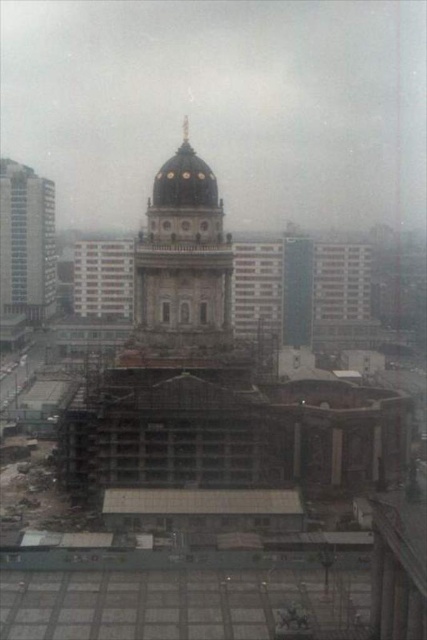
Question: From the image, what is the correct spatial relationship of dark gray stone dome at center in relation to white glass windows at left?

Choices:
 (A) right
 (B) left

Answer: (A)

Question: Can you confirm if dark gray stone dome at center is positioned to the left of white glass windows at left?

Choices:
 (A) no
 (B) yes

Answer: (A)

Question: Which object is the closest to the blue glass skyscraper at left?

Choices:
 (A) dark gray stone dome at center
 (B) white glass windows at left

Answer: (B)

Question: Which point appears farthest from the camera in this image?

Choices:
 (A) (129, 257)
 (B) (14, 257)

Answer: (B)

Question: Which of these objects is positioned closest to the blue glass skyscraper at left?

Choices:
 (A) white glass windows at left
 (B) dark gray stone dome at center

Answer: (A)

Question: Is dark gray stone dome at center positioned behind blue glass skyscraper at left?

Choices:
 (A) yes
 (B) no

Answer: (B)